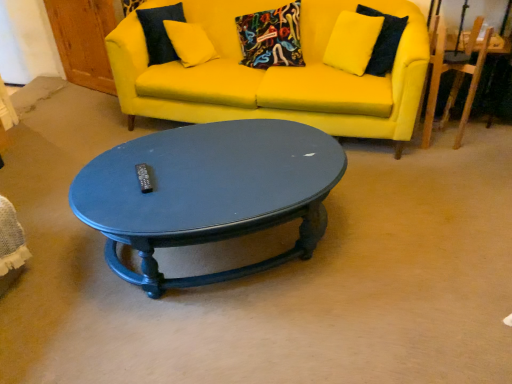
Question: Does matte yellow fabric couch at upper center come in front of wooden armchair at right?

Choices:
 (A) no
 (B) yes

Answer: (B)

Question: From the image's perspective, is matte yellow fabric couch at upper center above wooden armchair at right?

Choices:
 (A) yes
 (B) no

Answer: (A)

Question: Can you confirm if matte yellow fabric couch at upper center is bigger than wooden armchair at right?

Choices:
 (A) no
 (B) yes

Answer: (B)

Question: From a real-world perspective, is matte yellow fabric couch at upper center physically below wooden armchair at right?

Choices:
 (A) yes
 (B) no

Answer: (A)

Question: Is matte yellow fabric couch at upper center positioned far away from wooden armchair at right?

Choices:
 (A) no
 (B) yes

Answer: (A)

Question: Which is correct: wooden armchair at right is inside matte yellow fabric couch at upper center, or outside of it?

Choices:
 (A) outside
 (B) inside

Answer: (A)

Question: Considering their positions, is wooden armchair at right located in front of or behind matte yellow fabric couch at upper center?

Choices:
 (A) front
 (B) behind

Answer: (B)

Question: Based on their positions, is wooden armchair at right located to the left or right of matte yellow fabric couch at upper center?

Choices:
 (A) right
 (B) left

Answer: (A)

Question: Considering the positions of wooden armchair at right and matte yellow fabric couch at upper center in the image, is wooden armchair at right taller or shorter than matte yellow fabric couch at upper center?

Choices:
 (A) short
 (B) tall

Answer: (A)

Question: Is glossy dark blue coffee table at center taller or shorter than wooden armchair at right?

Choices:
 (A) short
 (B) tall

Answer: (A)

Question: Do you think glossy dark blue coffee table at center is within wooden armchair at right, or outside of it?

Choices:
 (A) inside
 (B) outside

Answer: (B)

Question: Is glossy dark blue coffee table at center to the left or to the right of wooden armchair at right in the image?

Choices:
 (A) right
 (B) left

Answer: (B)

Question: In the image, is glossy dark blue coffee table at center positioned in front of or behind wooden armchair at right?

Choices:
 (A) front
 (B) behind

Answer: (A)

Question: Relative to matte yellow fabric couch at upper center, is glossy dark blue coffee table at center in front or behind?

Choices:
 (A) behind
 (B) front

Answer: (B)

Question: In terms of width, does glossy dark blue coffee table at center look wider or thinner when compared to matte yellow fabric couch at upper center?

Choices:
 (A) wide
 (B) thin

Answer: (B)